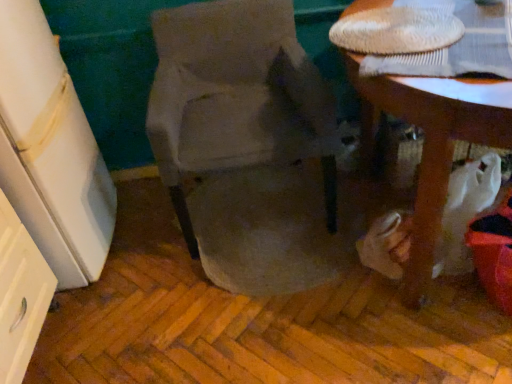
Question: Is white glossy drawer at left turned away from wooden table at lower right?

Choices:
 (A) yes
 (B) no

Answer: (B)

Question: Would you say wooden table at lower right is part of white glossy drawer at left's contents?

Choices:
 (A) no
 (B) yes

Answer: (A)

Question: Considering the relative positions of white glossy drawer at left and wooden table at lower right in the image provided, is white glossy drawer at left in front of wooden table at lower right?

Choices:
 (A) yes
 (B) no

Answer: (B)

Question: From a real-world perspective, is white glossy drawer at left under wooden table at lower right?

Choices:
 (A) yes
 (B) no

Answer: (B)

Question: Can you confirm if white glossy drawer at left is smaller than wooden table at lower right?

Choices:
 (A) yes
 (B) no

Answer: (A)

Question: From the image's perspective, is white glossy drawer at left located above wooden table at lower right?

Choices:
 (A) yes
 (B) no

Answer: (B)

Question: From a real-world perspective, does suede-like beige chair at center sit lower than wooden table at lower right?

Choices:
 (A) no
 (B) yes

Answer: (A)

Question: From the image's perspective, is suede-like beige chair at center beneath wooden table at lower right?

Choices:
 (A) no
 (B) yes

Answer: (A)

Question: Can we say suede-like beige chair at center lies outside wooden table at lower right?

Choices:
 (A) yes
 (B) no

Answer: (A)

Question: Is suede-like beige chair at center positioned before wooden table at lower right?

Choices:
 (A) no
 (B) yes

Answer: (A)

Question: From the image's perspective, is suede-like beige chair at center on wooden table at lower right?

Choices:
 (A) yes
 (B) no

Answer: (A)

Question: Considering the relative sizes of suede-like beige chair at center and wooden table at lower right in the image provided, is suede-like beige chair at center bigger than wooden table at lower right?

Choices:
 (A) yes
 (B) no

Answer: (B)

Question: Is wooden table at lower right taller than suede-like beige chair at center?

Choices:
 (A) no
 (B) yes

Answer: (B)